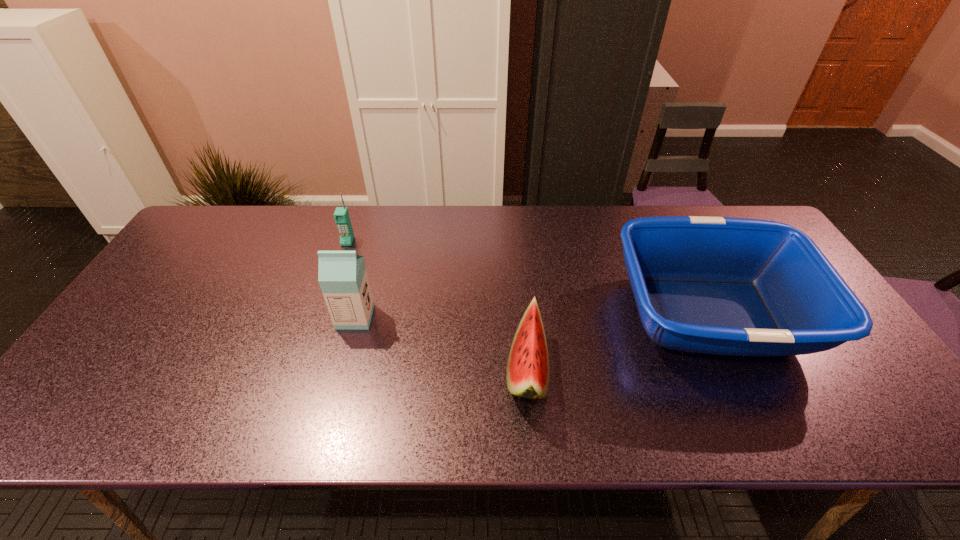
The image size is (960, 540). What are the coordinates of `vacant space at the near right corner` in the screenshot? It's located at (858, 431).

Where is `unoccupied area between the third object from left to right and the second object from left to right`? The image size is (960, 540). unoccupied area between the third object from left to right and the second object from left to right is located at coordinates (442, 344).

The image size is (960, 540). What are the coordinates of `free spot between the rightmost object and the third object from left to right` in the screenshot? It's located at (619, 342).

Where is `free space between the milk carton and the watermelon`? The height and width of the screenshot is (540, 960). free space between the milk carton and the watermelon is located at coordinates (442, 344).

Find the location of a particular element. free space between the watermelon and the leftmost object is located at coordinates (438, 306).

This screenshot has width=960, height=540. Identify the location of free space between the third object from left to right and the milk carton. (442, 344).

You are a GUI agent. You are given a task and a screenshot of the screen. Output one action in this format:
    pyautogui.click(x=<x>, y=<y>)
    Task: Click on the unoccupied position between the tallest object and the third object from left to right
    
    Given the screenshot: What is the action you would take?
    click(442, 344)

I want to click on the third closest object relative to the second object from right to left, so click(x=341, y=215).

Locate an element on the screen. The width and height of the screenshot is (960, 540). the third closest object to the tallest object is located at coordinates (730, 286).

Find the location of a particular element. free location that satisfies the following two spatial constraints: 1. on the keypad of the leftmost object; 2. on the right side of the rightmost object is located at coordinates (324, 314).